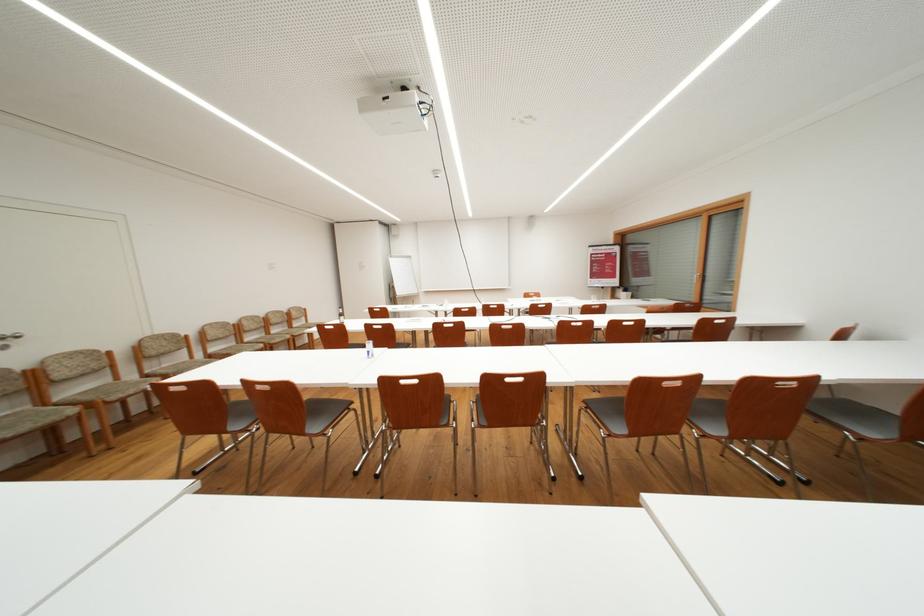
Find where to pull the metal door handle. Please return your answer as a coordinate pair (x, y).

(10, 336)